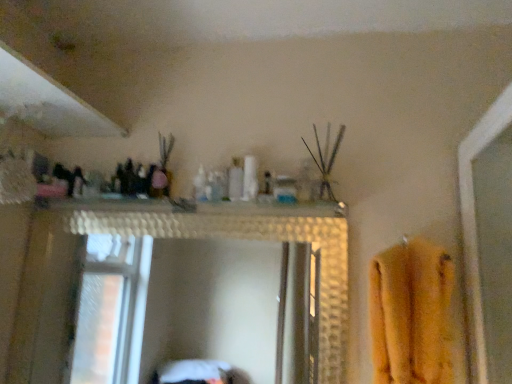
Where is `vacant space situated above white glossy shelf at upper center (from a real-world perspective)`? The image size is (512, 384). vacant space situated above white glossy shelf at upper center (from a real-world perspective) is located at coordinates (161, 197).